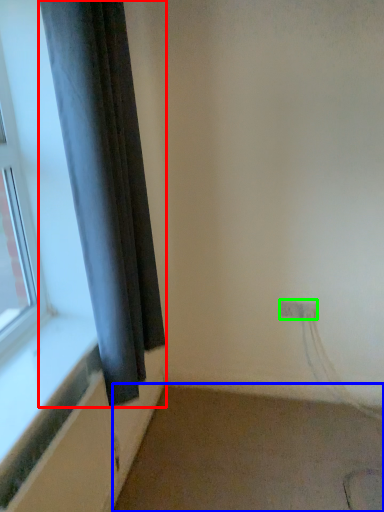
Question: Considering the real-world distances, which object is farthest from curtain (highlighted by a red box)? plain (highlighted by a blue box) or electric outlet (highlighted by a green box)?

Choices:
 (A) plain
 (B) electric outlet

Answer: (B)